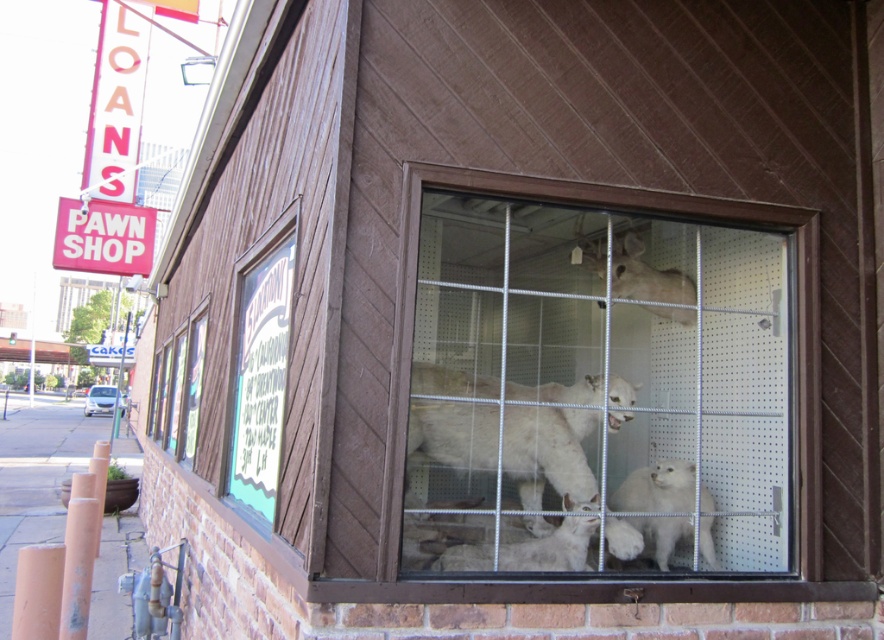
You are a delivery person who needs to place a large box in the corner of the building. The box must be placed where it won not block the view of the white fur taxidermy animals at center. Where should you place the box?

The white fur taxidermy animals at center are located at point (600,380), so the box should be placed away from this coordinate to avoid blocking their view.

You are a delivery person trying to place a new taxidermy piece into the window display. The new piece requires 60 centimeters of space. Based on the current arrangement of the white fur taxidermy animals at center and the white fluffy lamb at center, do you think there is enough space to fit the new piece between them?

The distance between the white fur taxidermy animals at center and the white fluffy lamb at center is 54.97 centimeters. Since the new taxidermy piece requires 60 centimeters of space, there is not enough space to fit it between them.

You are a customer standing outside the building looking at the window display. You notice two white fur animals in the display. Which one is positioned higher up between the white fur taxidermy animals at center and the white fur deer at upper center?

The white fur deer at upper center is positioned higher up than the white fur taxidermy animals at center.